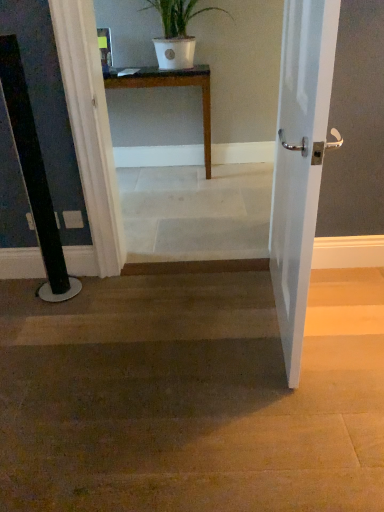
What do you see at coordinates (170, 86) in the screenshot? This screenshot has width=384, height=512. I see `wooden table at center` at bounding box center [170, 86].

Identify the location of wooden table at center. pos(170,86).

Is brown wood floor at center placed right next to wooden table at center?

brown wood floor at center and wooden table at center are not in contact.

Between point (248, 284) and point (160, 72), which one is positioned behind?

The point (160, 72) is farther from the camera.

Is wooden table at center located within brown wood floor at center?

No.

From a real-world perspective, who is located higher, brown wood floor at center or wooden table at center?

wooden table at center.

Which object is further away from the camera, white marble stairs at center or white glossy door at right?

Positioned behind is white marble stairs at center.

Does white marble stairs at center have a lesser height compared to white glossy door at right?

No, white marble stairs at center is not shorter than white glossy door at right.

This screenshot has height=512, width=384. What are the coordinates of `door in front of the white marble stairs at center` in the screenshot? It's located at (300, 162).

Considering the positions of point (212, 60) and point (106, 80), is point (212, 60) closer or farther from the camera than point (106, 80)?

Point (212, 60).

Considering the positions of objects white marble stairs at center and wooden table at center in the image provided, who is more to the right, white marble stairs at center or wooden table at center?

From the viewer's perspective, white marble stairs at center appears more on the right side.

Considering the sizes of white marble stairs at center and wooden table at center in the image, is white marble stairs at center wider or thinner than wooden table at center?

Considering their sizes, white marble stairs at center looks slimmer than wooden table at center.

From a real-world perspective, who is located higher, brown wood floor at center or white glossy door at right?

white glossy door at right, from a real-world perspective.

Who is smaller, brown wood floor at center or white glossy door at right?

white glossy door at right is smaller.

Considering the sizes of objects brown wood floor at center and white glossy door at right in the image provided, who is wider, brown wood floor at center or white glossy door at right?

Wider between the two is brown wood floor at center.

Is wooden table at center positioned beyond the bounds of white matte pot at upper center?

That's correct, wooden table at center is outside of white matte pot at upper center.

Between wooden table at center and white matte pot at upper center, which one has larger width?

With larger width is white matte pot at upper center.

Which of these two, wooden table at center or white matte pot at upper center, stands shorter?

white matte pot at upper center.

Locate an element on the screen. The width and height of the screenshot is (384, 512). houseplant on the right side of wooden table at center is located at coordinates (176, 31).

Relative to brown wood floor at center, is white matte pot at upper center in front or behind?

In the image, white matte pot at upper center appears behind brown wood floor at center.

Is white matte pot at upper center spatially inside brown wood floor at center, or outside of it?

white matte pot at upper center is outside brown wood floor at center.

What's the angular difference between white matte pot at upper center and brown wood floor at center's facing directions?

0.0533 degrees.

Which object is thinner, white matte pot at upper center or brown wood floor at center?

white matte pot at upper center is thinner.

The height and width of the screenshot is (512, 384). Identify the location of table on the left of the white glossy door at right. (170, 86).

Considering the sizes of objects white glossy door at right and wooden table at center in the image provided, who is shorter, white glossy door at right or wooden table at center?

wooden table at center is shorter.

Between white glossy door at right and wooden table at center, which one is positioned in front?

white glossy door at right is more forward.

Considering the sizes of white glossy door at right and wooden table at center in the image, is white glossy door at right bigger or smaller than wooden table at center?

In the image, white glossy door at right appears to be smaller than wooden table at center.

This screenshot has width=384, height=512. What are the coordinates of `table located on the left of brown wood floor at center` in the screenshot? It's located at (170, 86).

In order to click on corridor above the white glossy door at right (from the image's perspective) in this screenshot , I will do `click(241, 76)`.

When comparing their distances from wooden table at center, does white matte pot at upper center or white marble stairs at center seem further?

Based on the image, white marble stairs at center appears to be further to wooden table at center.

Considering their positions, is white marble stairs at center positioned further to white matte pot at upper center than white glossy door at right?

white glossy door at right is positioned further to the anchor white matte pot at upper center.

Which object lies nearer to the anchor point wooden table at center, white glossy door at right or brown wood floor at center?

Based on the image, white glossy door at right appears to be nearer to wooden table at center.

Considering their positions, is white matte pot at upper center positioned further to white glossy door at right than white marble stairs at center?

The object further to white glossy door at right is white marble stairs at center.

Considering their positions, is white marble stairs at center positioned closer to white glossy door at right than brown wood floor at center?

brown wood floor at center lies closer to white glossy door at right than the other object.

When comparing their distances from wooden table at center, does white marble stairs at center or brown wood floor at center seem further?

Among the two, brown wood floor at center is located further to wooden table at center.

Which object lies nearer to the anchor point wooden table at center, white marble stairs at center or white glossy door at right?

white marble stairs at center is closer to wooden table at center.

From the image, which object appears to be nearer to white marble stairs at center, wooden table at center or brown wood floor at center?

wooden table at center is closer to white marble stairs at center.

You are a GUI agent. You are given a task and a screenshot of the screen. Output one action in this format:
    pyautogui.click(x=<x>, y=<y>)
    Task: Click on the corridor between white matte pot at upper center and brown wood floor at center vertically
    This screenshot has height=512, width=384.
    Given the screenshot: What is the action you would take?
    pyautogui.click(x=241, y=76)

Image resolution: width=384 pixels, height=512 pixels. Identify the location of houseplant between white glossy door at right and wooden table at center along the z-axis. pyautogui.click(x=176, y=31).

This screenshot has height=512, width=384. What are the coordinates of `stairwell between white glossy door at right and wooden table at center from front to back` in the screenshot? It's located at (191, 396).

Find the location of a particular element. This screenshot has height=512, width=384. corridor between white glossy door at right and wooden table at center from front to back is located at coordinates (x=241, y=76).